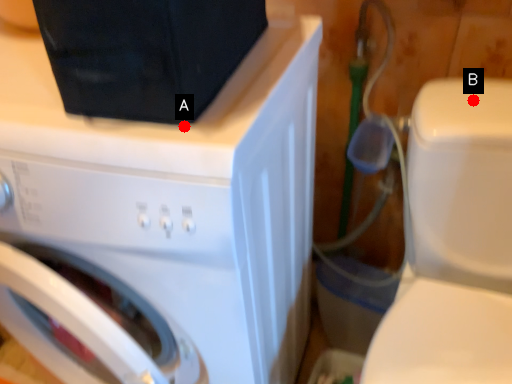
Question: Two points are circled on the image, labeled by A and B beside each circle. Among these points, which one is nearest to the camera?

Choices:
 (A) A is closer
 (B) B is closer

Answer: (A)